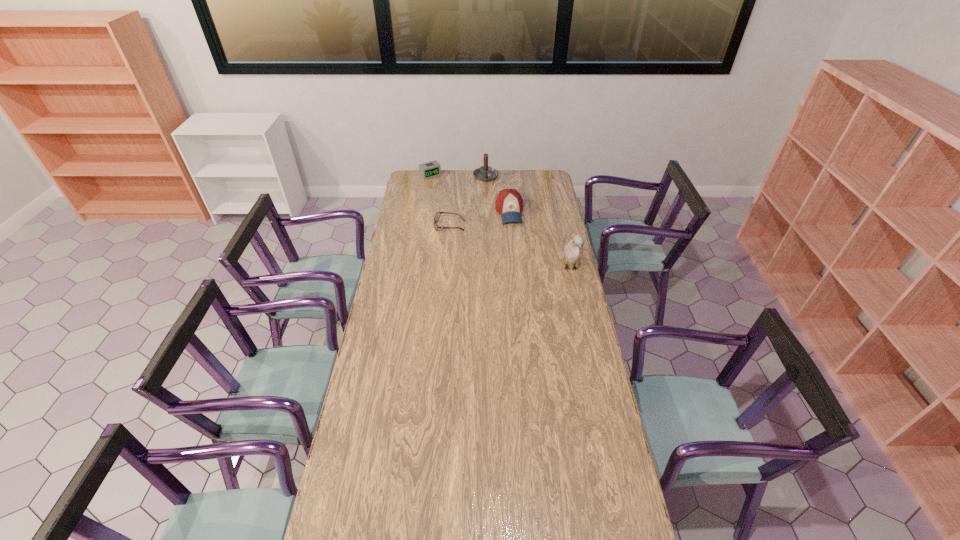
The image size is (960, 540). I want to click on vacant space located 0.140m on the side of the candle with the handle loop, so click(x=493, y=197).

Locate an element on the screen. The width and height of the screenshot is (960, 540). vacant space situated 0.110m on the side of the candle with the handle loop is located at coordinates (492, 194).

Where is `free space located 0.210m on the side of the candle with the handle loop`? The height and width of the screenshot is (540, 960). free space located 0.210m on the side of the candle with the handle loop is located at coordinates (496, 203).

Find the location of a particular element. The width and height of the screenshot is (960, 540). vacant space situated on the front-facing side of the third shortest object is located at coordinates (515, 240).

At what (x,y) coordinates should I click in order to perform the action: click on vacant space located 0.140m on the front-facing side of the third shortest object. Please return your answer as a coordinate pair (x, y). This screenshot has width=960, height=540. Looking at the image, I should click on (516, 241).

Identify the location of vacant region located 0.330m on the front-facing side of the third shortest object. (520, 265).

Identify the location of free space located 0.400m on the front-facing side of the fourth tallest object. (465, 211).

Find the location of a particular element. The width and height of the screenshot is (960, 540). free location located on the front-facing side of the fourth tallest object is located at coordinates pyautogui.click(x=444, y=188).

Image resolution: width=960 pixels, height=540 pixels. In order to click on free point located on the front-facing side of the fourth tallest object in this screenshot , I will do `click(442, 186)`.

Locate an element on the screen. candle at the far edge is located at coordinates (485, 173).